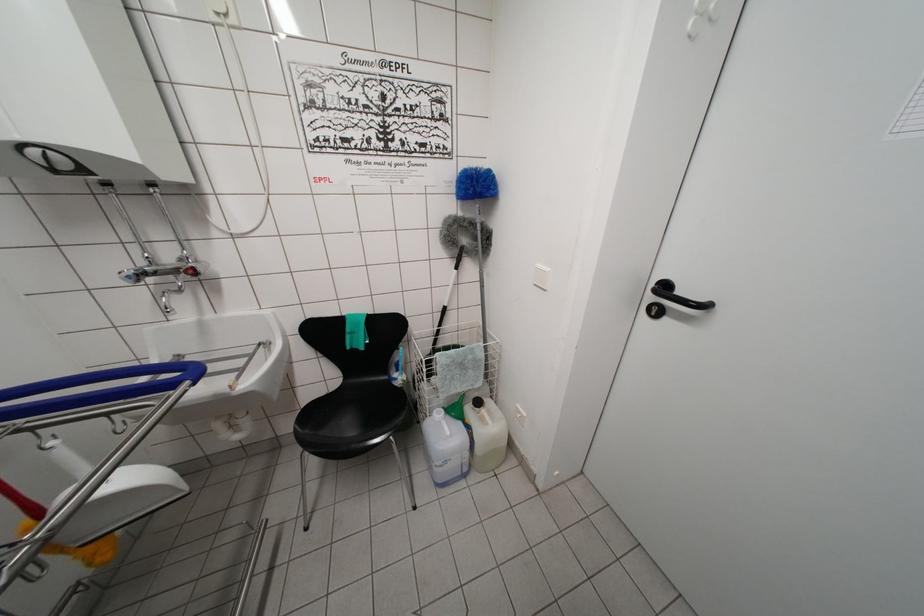
Find the location of `white light switch`. white light switch is located at coordinates 541,277.